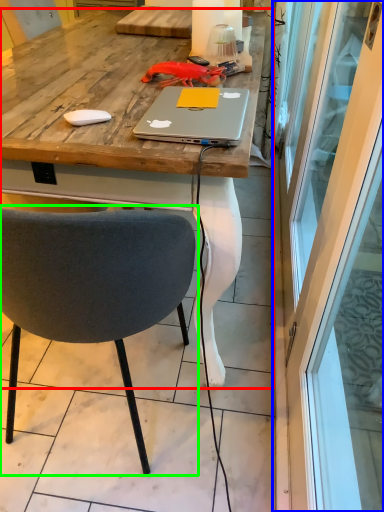
Question: Based on their relative distances, which object is nearer to desk (highlighted by a red box)? Choose from screen door (highlighted by a blue box) and chair (highlighted by a green box).

Choices:
 (A) screen door
 (B) chair

Answer: (B)